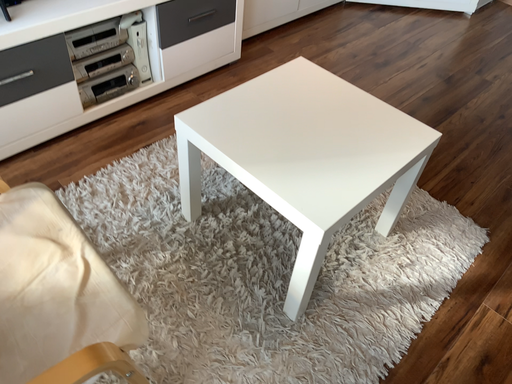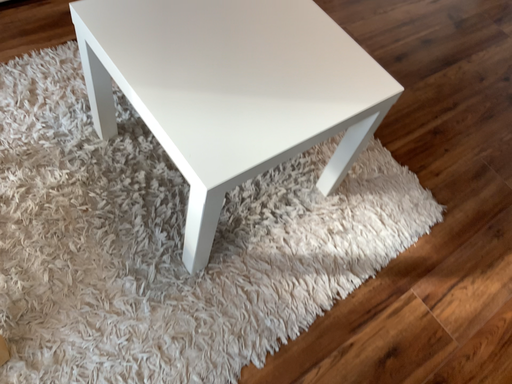
Question: How did the camera likely rotate when shooting the video?

Choices:
 (A) rotated upward
 (B) rotated downward

Answer: (B)